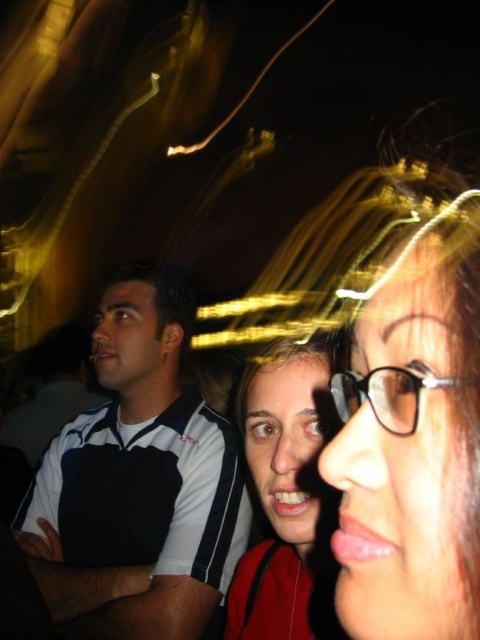
Who is more forward, (x=197, y=504) or (x=400, y=406)?

Point (x=400, y=406) is more forward.

In order to click on white and black striped polo shirt at left in this screenshot , I will do `click(145, 470)`.

Is point (219, 536) farther from viewer compared to point (396, 384)?

Yes, it is.

Find the location of a particular element. The image size is (480, 640). white and black striped polo shirt at left is located at coordinates (145, 470).

Does matte black glasses at center lie in front of transparent plastic glasses at center?

No, it is not.

The height and width of the screenshot is (640, 480). What do you see at coordinates (408, 412) in the screenshot?
I see `matte black glasses at center` at bounding box center [408, 412].

In order to click on matte black glasses at center in this screenshot , I will do [408, 412].

Between point (316, 353) and point (357, 376), which one is positioned in front?

Point (357, 376) is more forward.

Is matte red backpack at center behind transparent plastic glasses at center?

Yes.

Describe the element at coordinates (288, 497) in the screenshot. I see `matte red backpack at center` at that location.

Locate an element on the screen. matte red backpack at center is located at coordinates (288, 497).